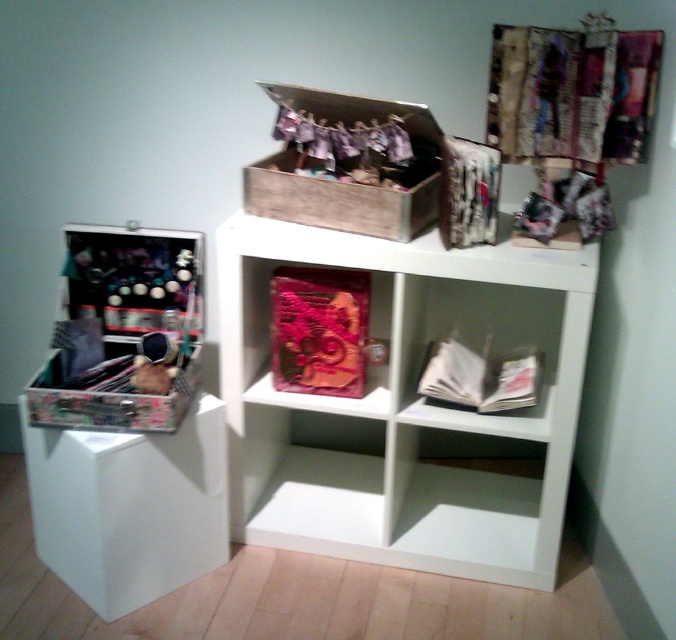
Question: Based on their relative distances, which object is nearer to the pink fabric box at center?

Choices:
 (A) white matte bookshelf at center
 (B) wooden box at center
 (C) clear plastic drawer at left

Answer: (A)

Question: Which point is closer to the camera?

Choices:
 (A) (349, 298)
 (B) (189, 554)
 (C) (481, 291)

Answer: (A)

Question: Observing the image, what is the correct spatial positioning of wooden box at center in reference to pink fabric box at center?

Choices:
 (A) above
 (B) below

Answer: (A)

Question: Does clear plastic drawer at left appear under pink fabric box at center?

Choices:
 (A) yes
 (B) no

Answer: (A)

Question: Estimate the real-world distances between objects in this image. Which object is closer to the pink fabric box at center?

Choices:
 (A) clear plastic drawer at left
 (B) wooden box at center

Answer: (B)

Question: Can you confirm if white matte bookshelf at center is thinner than clear plastic drawer at left?

Choices:
 (A) yes
 (B) no

Answer: (B)